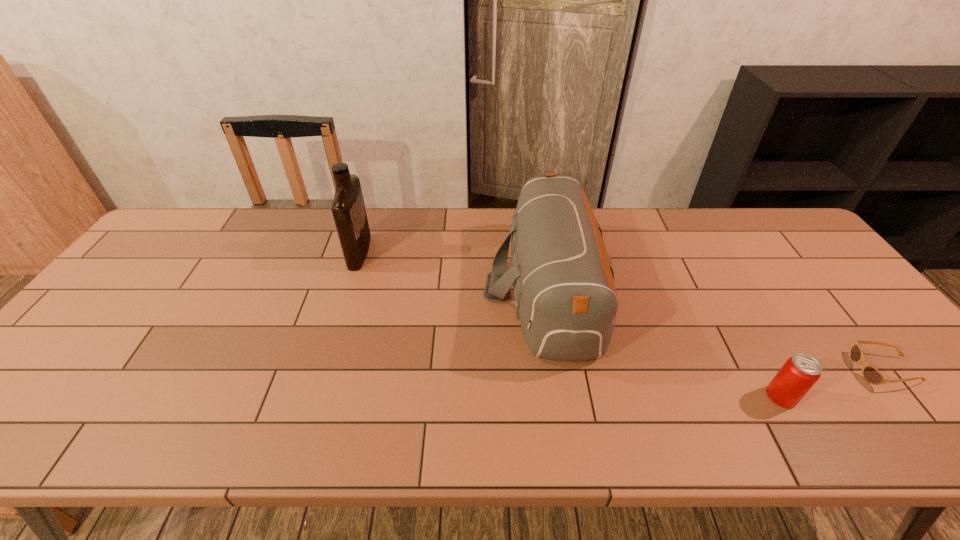
Where is `the tallest object`? This screenshot has height=540, width=960. the tallest object is located at coordinates (348, 208).

Identify the location of the leftmost object. This screenshot has height=540, width=960. (348, 208).

Identify the location of the third object from right to left. (565, 298).

The height and width of the screenshot is (540, 960). What are the coordinates of `the second tallest object` in the screenshot? It's located at (565, 298).

Locate an element on the screen. the second object from right to left is located at coordinates (800, 372).

Identify the location of can. This screenshot has width=960, height=540. (800, 372).

Image resolution: width=960 pixels, height=540 pixels. I want to click on the shortest object, so click(872, 375).

The height and width of the screenshot is (540, 960). In order to click on the rightmost object in this screenshot , I will do `click(872, 375)`.

Locate an element on the screen. This screenshot has width=960, height=540. blank area located 0.330m on the label side of the tallest object is located at coordinates (476, 252).

Locate an element on the screen. vacant space located on the left of the duffel bag is located at coordinates (345, 288).